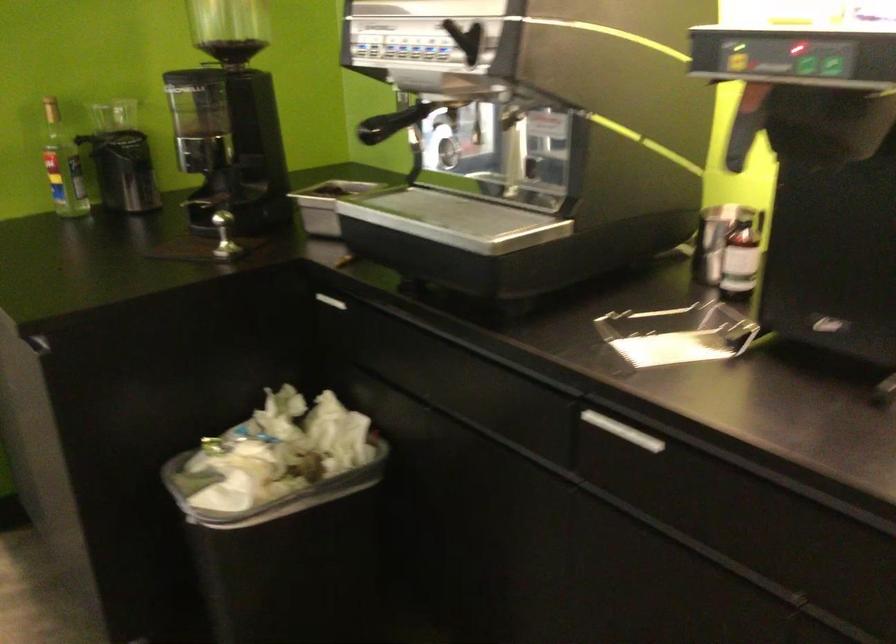
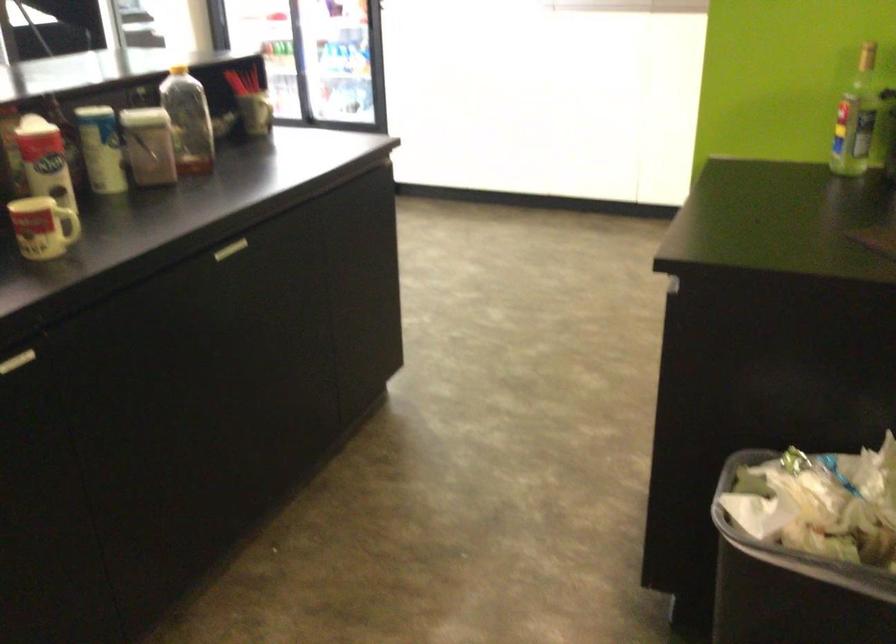
Question: How did the camera likely rotate?

Choices:
 (A) Left
 (B) Right
 (C) Up
 (D) Down

Answer: (A)